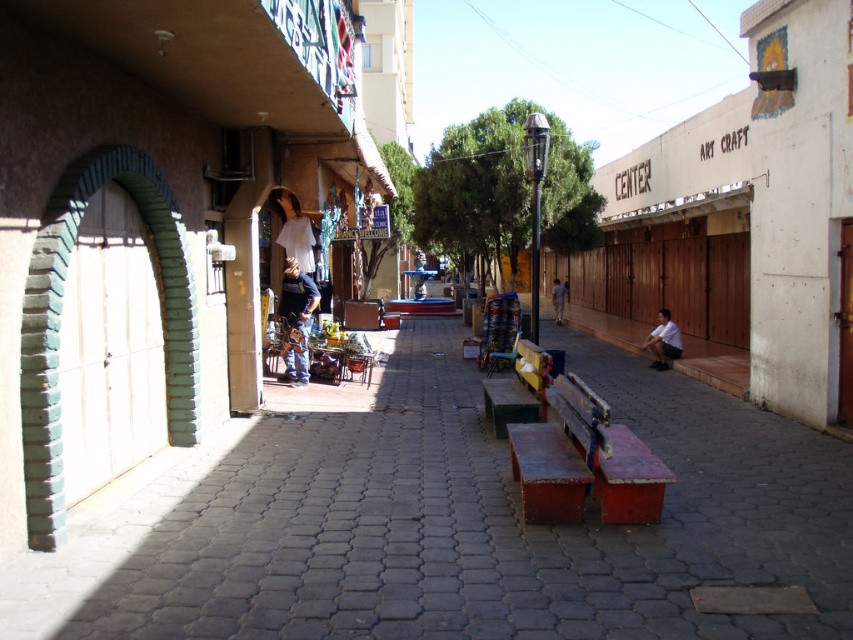
Question: Is paved stone at center thinner than light brown fabric pants at center?

Choices:
 (A) yes
 (B) no

Answer: (B)

Question: Which is farther from the paved stone at center?

Choices:
 (A) denim jeans at center
 (B) rusty wood bench at center

Answer: (A)

Question: Estimate the real-world distances between objects in this image. Which object is closer to the rusty wood bench at center?

Choices:
 (A) wooden bench at center
 (B) white matte shirt at center
 (C) paved stone at center

Answer: (C)

Question: Does white matte shirt at center appear over light brown fabric pants at center?

Choices:
 (A) yes
 (B) no

Answer: (B)

Question: Which point appears closest to the camera in this image?

Choices:
 (A) (498, 380)
 (B) (294, 284)
 (C) (563, 298)

Answer: (A)

Question: Is paved stone at center further to the viewer compared to white matte shirt at center?

Choices:
 (A) yes
 (B) no

Answer: (B)